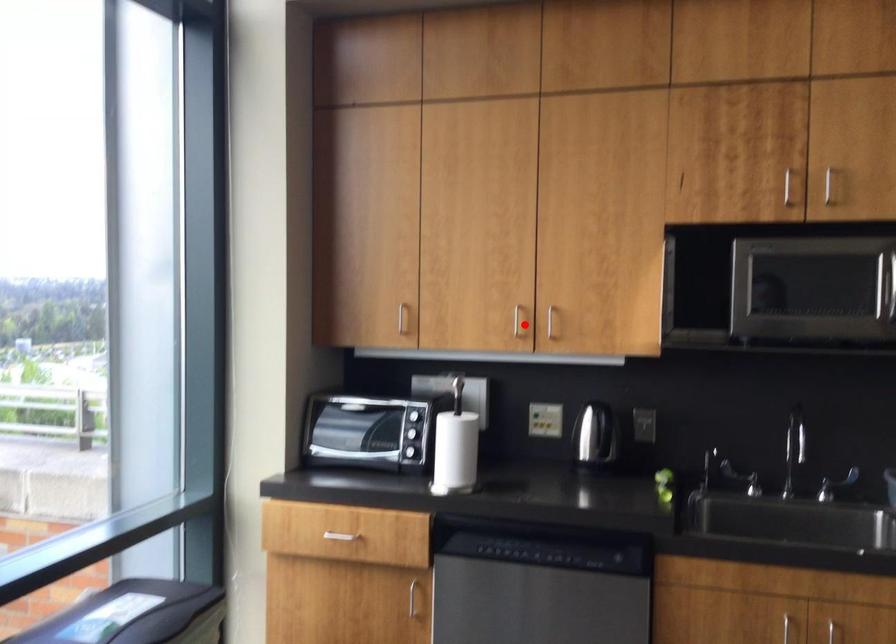
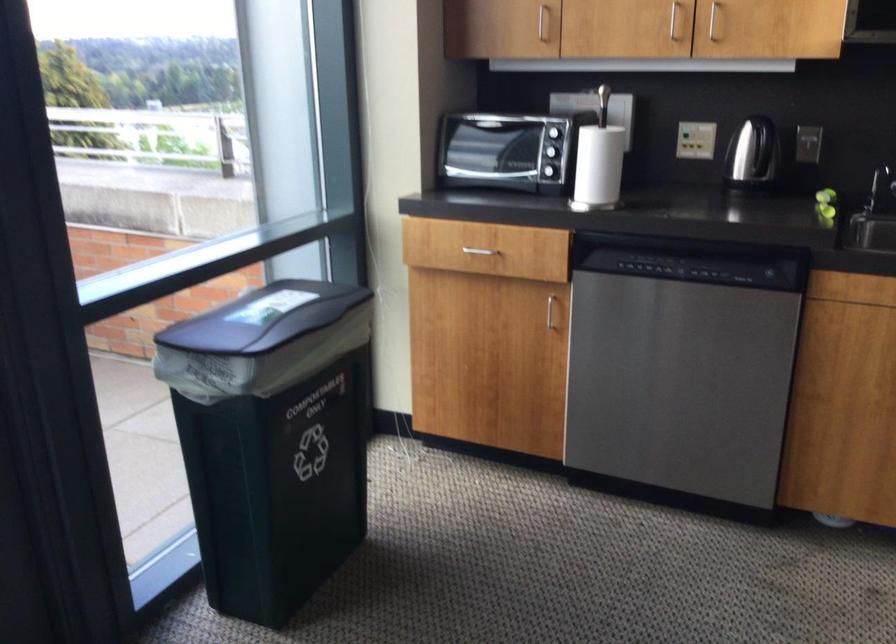
Question: I am providing you with two images of the same scene from different viewpoints. Given a red point in image1, look at the same physical point in image2. Is it:

Choices:
 (A) Closer to the viewpoint
 (B) Farther from the viewpoint

Answer: (A)